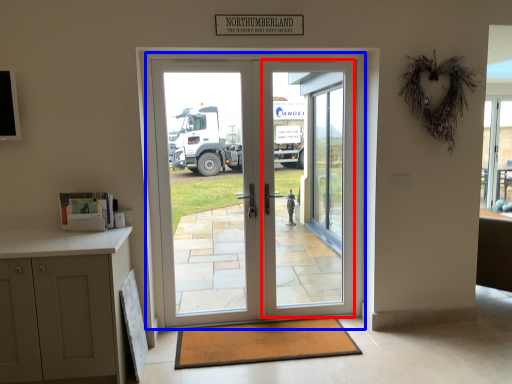
Question: Which object appears closest to the camera in this image, screen door (highlighted by a red box) or door (highlighted by a blue box)?

Choices:
 (A) screen door
 (B) door

Answer: (B)